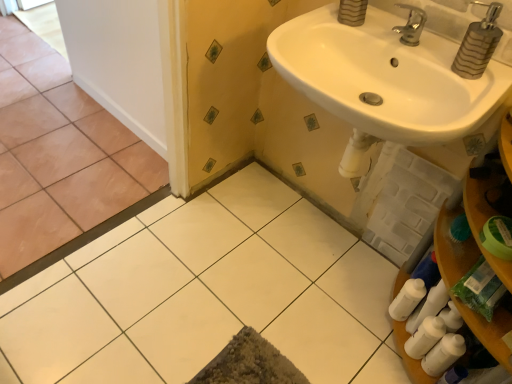
Where is `vacant space behind metallic striped soap dispenser at upper right`? This screenshot has height=384, width=512. vacant space behind metallic striped soap dispenser at upper right is located at coordinates (430, 44).